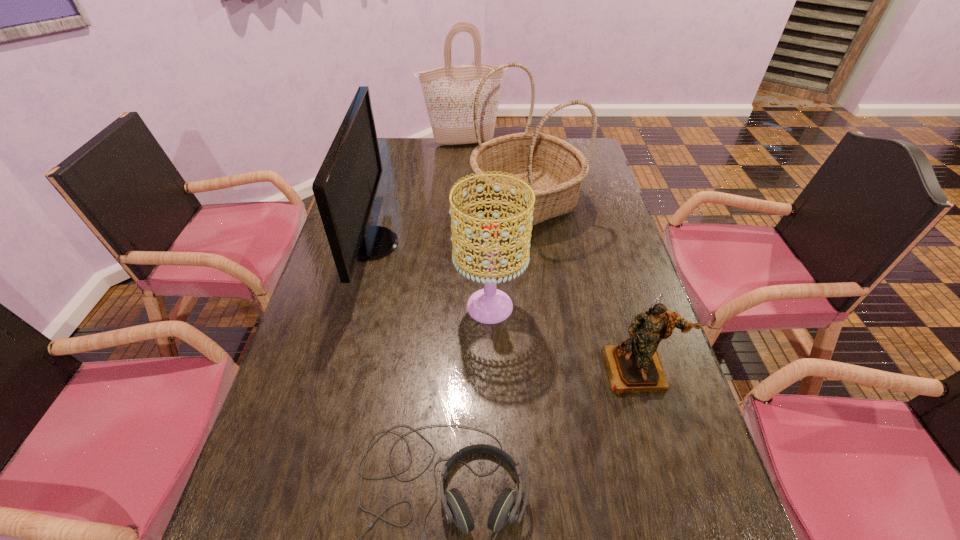
In order to click on vacant area that lies between the lampshade and the basket in this screenshot , I will do `click(508, 254)`.

This screenshot has width=960, height=540. Find the location of `vacant area between the basket and the lampshade`. vacant area between the basket and the lampshade is located at coordinates (508, 254).

Find the location of a particular element. unoccupied area between the basket and the lampshade is located at coordinates (508, 254).

Locate an element on the screen. The height and width of the screenshot is (540, 960). vacant space in between the computer monitor and the shopping bag is located at coordinates (418, 193).

Identify which object is the closest to the shopping bag. Please provide its 2D coordinates. Your answer should be formatted as a tuple, i.e. [(x, y)], where the tuple contains the x and y coordinates of a point satisfying the conditions above.

[(555, 169)]

Identify which object is the fourth nearest to the shopping bag. Please provide its 2D coordinates. Your answer should be formatted as a tuple, i.e. [(x, y)], where the tuple contains the x and y coordinates of a point satisfying the conditions above.

[(634, 366)]